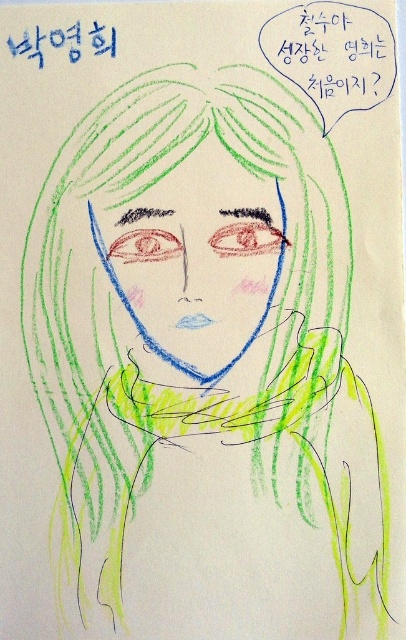
Question: Where is black marker name at upper left located in relation to reddish-brown eye at center in the image?

Choices:
 (A) right
 (B) left

Answer: (B)

Question: Which point is farther from the camera taking this photo?

Choices:
 (A) (388, 61)
 (B) (233, 227)

Answer: (B)

Question: Can you confirm if reddish-brown eye at center is positioned above red crayon eye at center?

Choices:
 (A) no
 (B) yes

Answer: (B)

Question: Does black marker name at upper left have a lesser width compared to reddish-brown eye at center?

Choices:
 (A) no
 (B) yes

Answer: (A)

Question: Among these points, which one is farthest from the camera?

Choices:
 (A) (362, 68)
 (B) (114, 29)
 (C) (226, 230)

Answer: (B)

Question: Which point is closer to the camera?

Choices:
 (A) (222, 232)
 (B) (377, 44)
 (C) (73, 52)

Answer: (B)